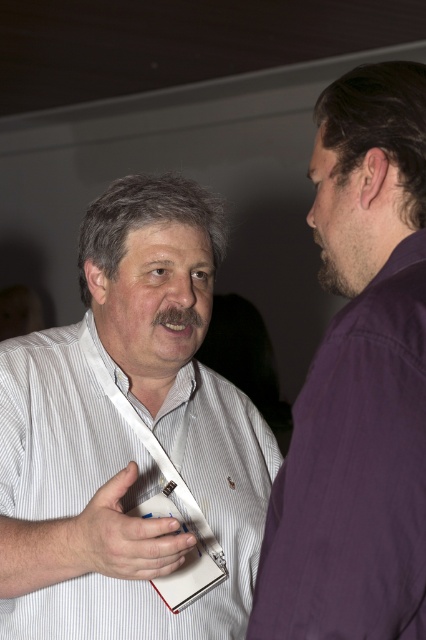
You are standing in the scene and want to point to the location of the point at coordinates (129,436). Which object in the scene should you point to?

The point at coordinates (129,436) is located on the white striped shirt at center, so you should point to the white striped shirt at center.

You are organizing a photo album and need to decide which item to place first based on size. According to the image, which is larger between the purple cotton shirt at right and the white paper at center?

The purple cotton shirt at right is bigger than the white paper at center, so it should be placed first in the photo album based on size.

You are a photographer standing at a distance. You want to take a closeup photo of the white striped shirt at center. The camera you are using has a minimum focusing distance of 35 inches. Can you take the photo without moving closer?

The white striped shirt at center is 34.40 inches away from camera, which is within the camera minimum focusing distance of 35 inches. Therefore, you can take the photo without moving closer.